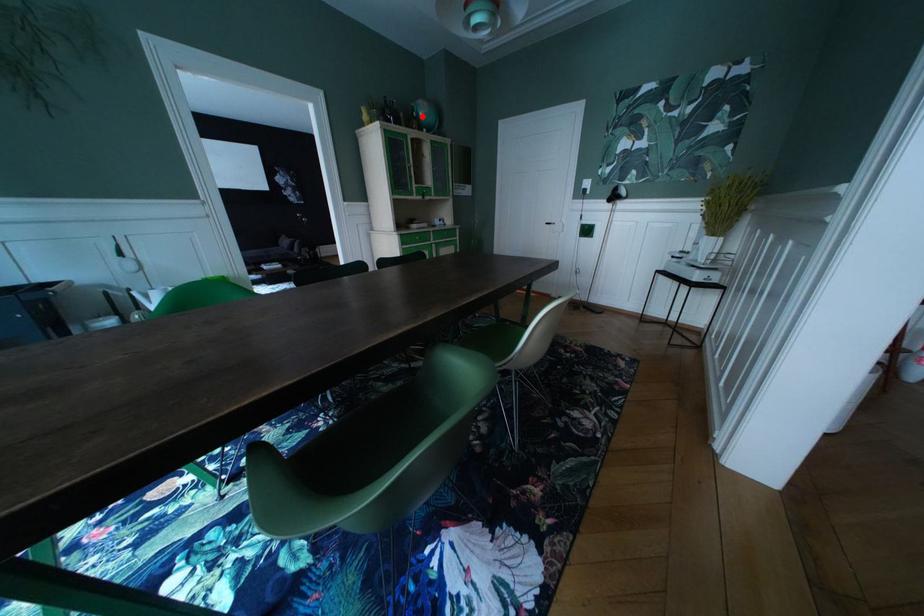
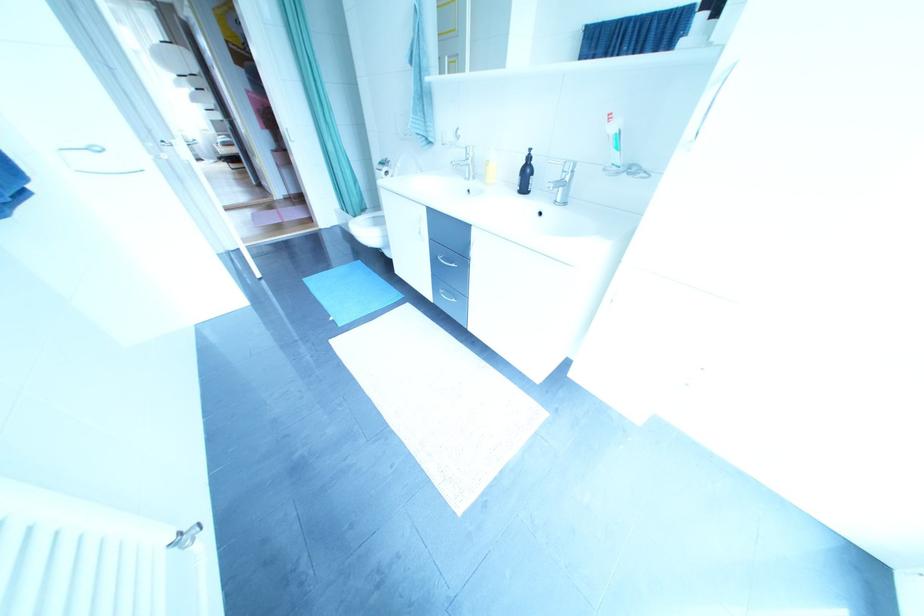
Question: I am providing you with two images of the same scene from different viewpoints. A red point is marked on the first image. At the location where the point appears in image 1, is it still visible in image 2?

Choices:
 (A) Yes
 (B) No

Answer: (B)